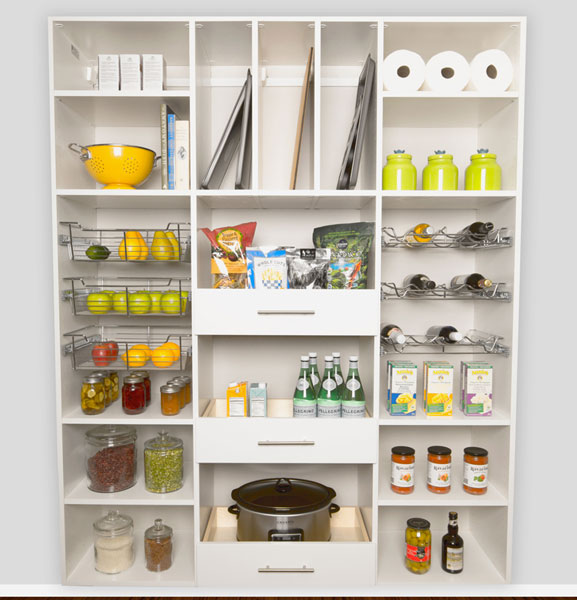
Show me where books, paper towels, metal jars  (misc. items) are located in the image. Your answer should be formatted as a list of tuples, i.e. [(x1, y1), (x2, y2), ...], where each tuple contains the x and y coordinates of a point satisfying the conditions above.

[(162, 154), (168, 159), (179, 163), (402, 82), (448, 79), (484, 82), (485, 172), (429, 174), (407, 175)]